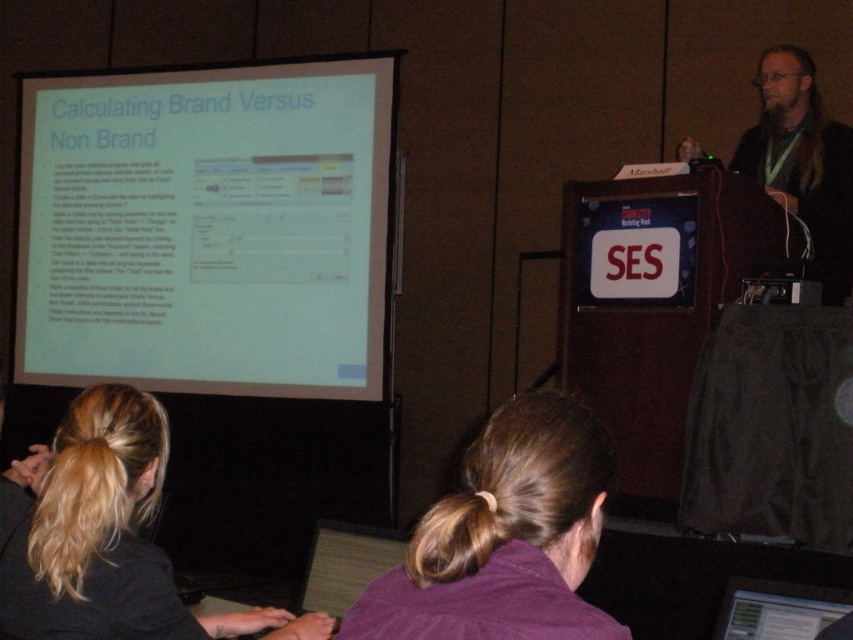
Question: Among these points, which one is farthest from the camera?

Choices:
 (A) (776, 176)
 (B) (815, 604)
 (C) (601, 520)
 (D) (19, 614)

Answer: (A)

Question: Can you confirm if blonde hair at upper left is smaller than matte black laptop at lower right?

Choices:
 (A) no
 (B) yes

Answer: (A)

Question: Is red plastic ses sign at center wider than matte black laptop at lower right?

Choices:
 (A) yes
 (B) no

Answer: (A)

Question: Considering the relative positions of brown hair at center and blonde hair at upper left in the image provided, where is brown hair at center located with respect to blonde hair at upper left?

Choices:
 (A) below
 (B) above

Answer: (B)

Question: Which point is farther to the camera?

Choices:
 (A) red plastic ses sign at center
 (B) matte black laptop at lower right
 (C) blonde hair at upper left
 (D) brown hair at center

Answer: (A)

Question: Among these points, which one is nearest to the camera?

Choices:
 (A) (171, 602)
 (B) (611, 220)
 (C) (764, 602)

Answer: (A)